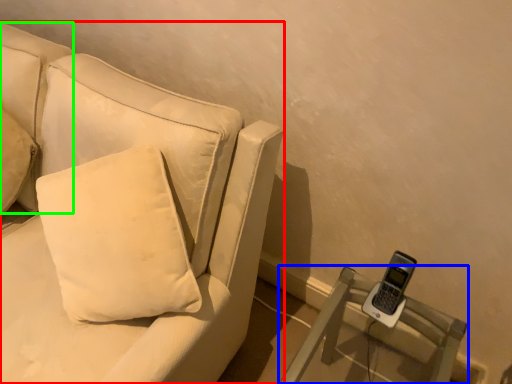
Question: Which object is the closest to the studio couch (highlighted by a red box)? Choose among these: furniture (highlighted by a blue box) or pillow (highlighted by a green box).

Choices:
 (A) furniture
 (B) pillow

Answer: (B)